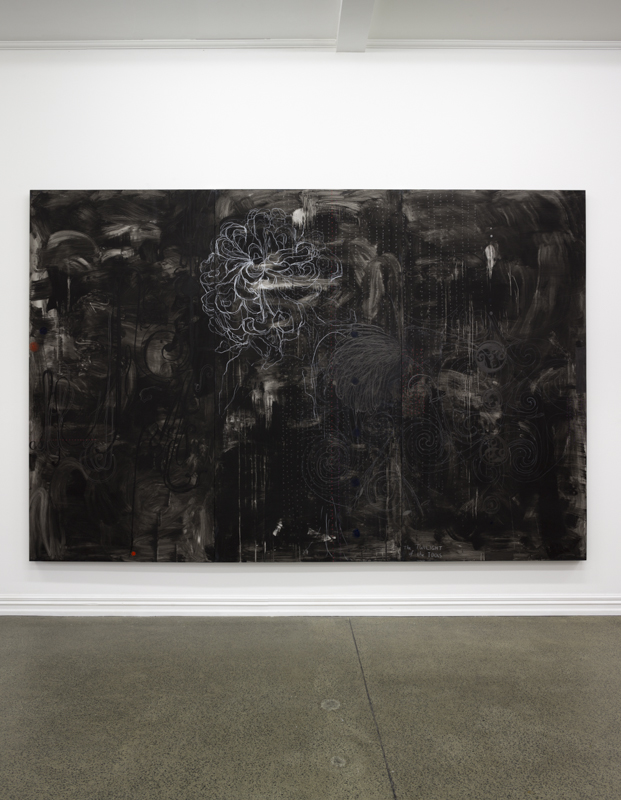
The width and height of the screenshot is (621, 800). Identify the location of nebula type thing in painting. (248, 260).